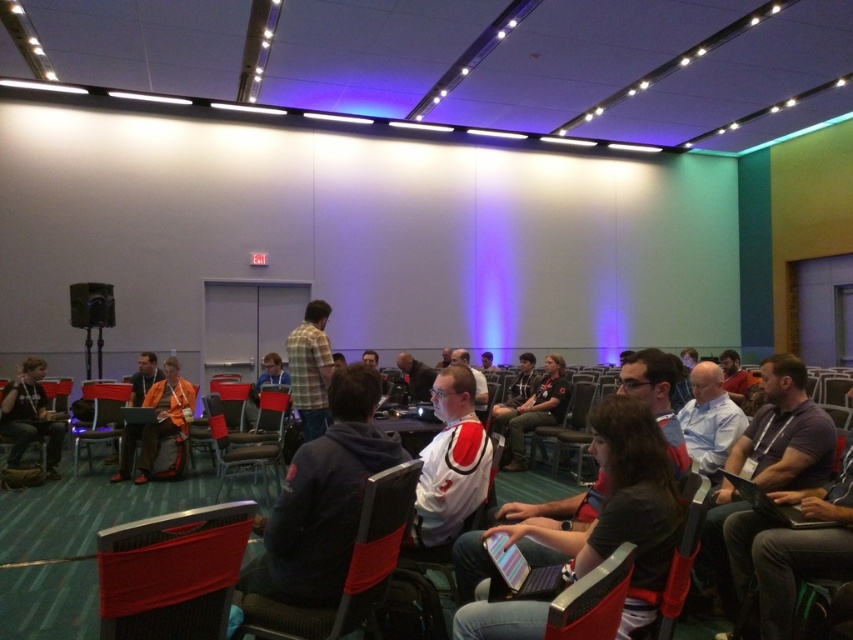
You are organizing a photo shoot in the conference room. You need to ensure that the matte white shirt at center is visible in the frame without being blocked by the black fabric chair at center. Based on their sizes, can you position them so that the shirt remains visible?

The matte white shirt at center is wider than the black fabric chair at center. Therefore, positioning the shirt slightly to the side of the chair would allow its full width to remain visible in the frame without obstruction.

You are sitting in the wooden chair at center and want to move to the front of the room. Is the matte black chair at center blocking your path?

The matte black chair at center is above the wooden chair at center, so it is located in front of you. Therefore, the matte black chair at center is blocking your path to the front of the room.

Looking at this image, you are organizing a workshop in this conference room and need to seat two participants. You have a matte black chair at center and a wooden chair at center available. If you want to choose the wider chair for better comfort, which one should you pick?

The matte black chair at center has a larger width than the wooden chair at center, so you should choose the matte black chair at center for better comfort.